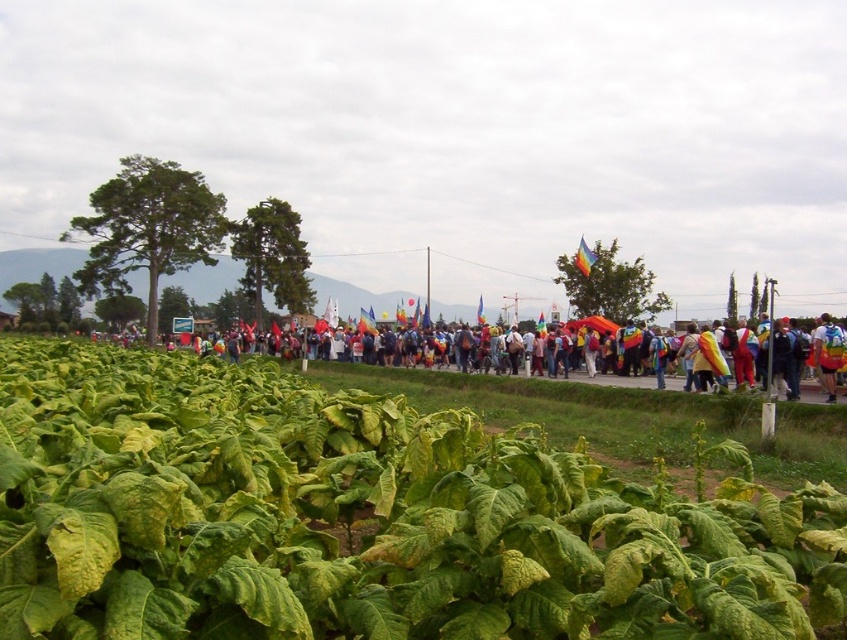
You are standing at the camera position and want to reach a specific point in the scene. The point is located at coordinates point (x=26, y=595). Can you walk directly to this point without moving through any objects?

The distance of point (x=26, y=595) from camera is 2.34 meters. Since there are no objects blocking the path to this point, you can walk directly to it.

In the scene shown: You are a photographer trying to capture the protest scene in the image. You want to ensure the green leafy plant at center is in the frame. Where should you position your camera to include it?

The green leafy plant at center is located at point [364,518]. To include it in the frame, position the camera so that this coordinate is within the camera view.